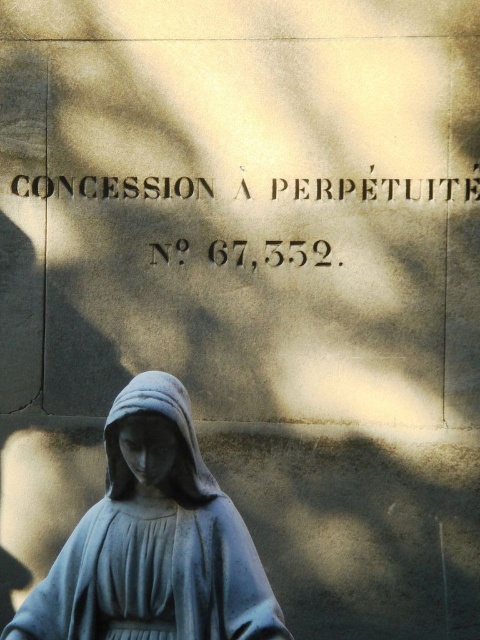
You are standing in front of the stone monument with the inscription. You notice a specific point marked at coordinates (154, 541). Which object in the scene does this point indicate?

The point at coordinates (154, 541) corresponds to the gray stone statue at lower center.

You are standing in front of the stone monument and want to locate the dark gray stone inscription at upper center. According to its position, which direction should you look to find it?

The dark gray stone inscription at upper center is located at point (376, 189), which means you should look towards the upper center direction to find it.